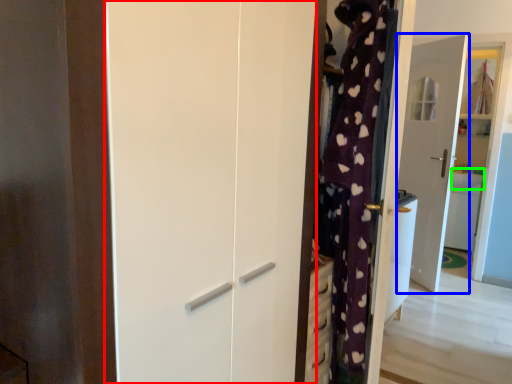
Question: Estimate the real-world distances between objects in this image. Which object is closer to screen door (highlighted by a red box), door (highlighted by a blue box) or counter top (highlighted by a green box)?

Choices:
 (A) door
 (B) counter top

Answer: (A)